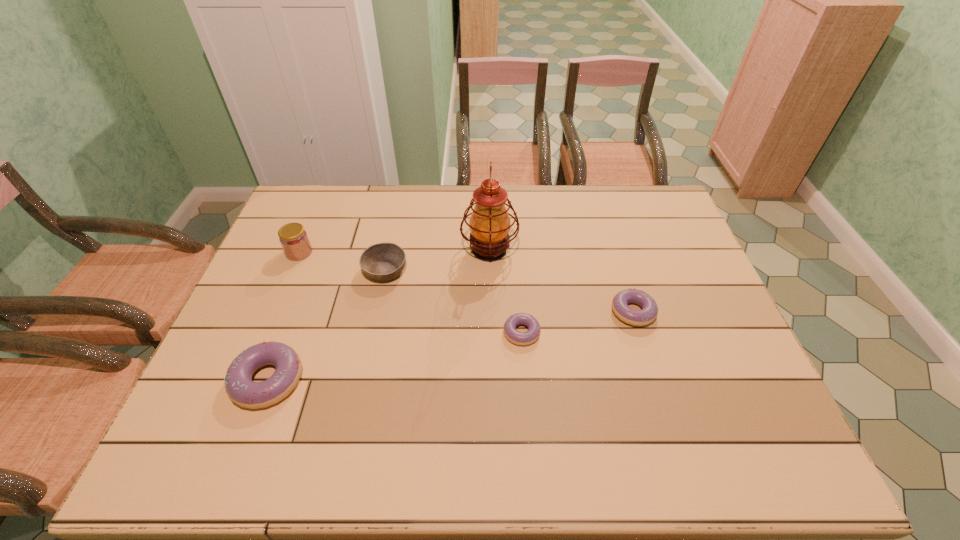
At what (x,y) coordinates should I click in order to perform the action: click on vacant space at the near edge of the desktop. Please return your answer as a coordinate pair (x, y). Looking at the image, I should click on (316, 401).

Where is `blank area at the left edge`? The height and width of the screenshot is (540, 960). blank area at the left edge is located at coordinates (262, 378).

I want to click on free space at the right edge, so click(x=689, y=261).

Where is `vacant space at the far left corner of the desktop`? The height and width of the screenshot is (540, 960). vacant space at the far left corner of the desktop is located at coordinates (319, 188).

In the image, there is a desktop. Identify the location of vacant space at the near right corner. This screenshot has height=540, width=960. (x=720, y=417).

This screenshot has height=540, width=960. In order to click on free space that is in between the tallest doughnut and the fifth shortest object in this screenshot , I will do click(283, 316).

The image size is (960, 540). I want to click on free space between the second doughnut from left to right and the jam, so click(411, 293).

You are a GUI agent. You are given a task and a screenshot of the screen. Output one action in this format:
    pyautogui.click(x=<x>, y=<y>)
    Task: Click on the free space between the bowl and the shortest object
    
    Given the screenshot: What is the action you would take?
    pyautogui.click(x=453, y=302)

Locate an element on the screen. The height and width of the screenshot is (540, 960). vacant point located between the nearest doughnut and the tallest object is located at coordinates (378, 315).

Where is `free point between the fourth object from right to left and the rightmost object`? This screenshot has height=540, width=960. free point between the fourth object from right to left and the rightmost object is located at coordinates (509, 291).